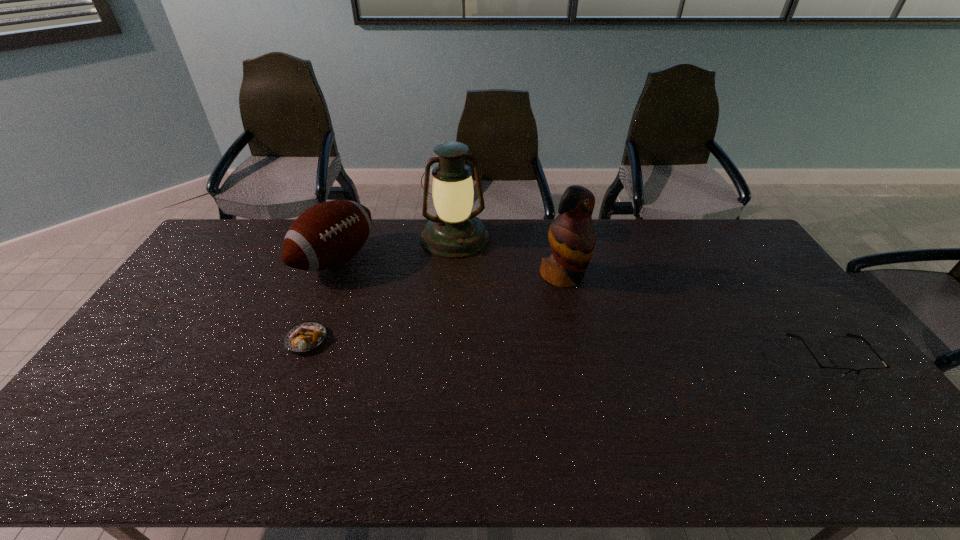
Where is `free area in between the third tallest object and the rightmost object`? The image size is (960, 540). free area in between the third tallest object and the rightmost object is located at coordinates [x=584, y=308].

Locate an element on the screen. The image size is (960, 540). free area in between the rightmost object and the pastry is located at coordinates (569, 348).

Select which object is the third closest to the pastry. Please provide its 2D coordinates. Your answer should be formatted as a tuple, i.e. [(x, y)], where the tuple contains the x and y coordinates of a point satisfying the conditions above.

[(572, 237)]

Find the location of a particular element. This screenshot has height=540, width=960. object that is the third closest to the football is located at coordinates (572, 237).

Locate an element on the screen. The width and height of the screenshot is (960, 540). vacant space that satisfies the following two spatial constraints: 1. on the front side of the fourth object from left to right; 2. on the left side of the football is located at coordinates (329, 276).

The image size is (960, 540). In order to click on free spot that satisfies the following two spatial constraints: 1. on the front side of the parrot; 2. on the left side of the football in this screenshot , I will do `click(329, 276)`.